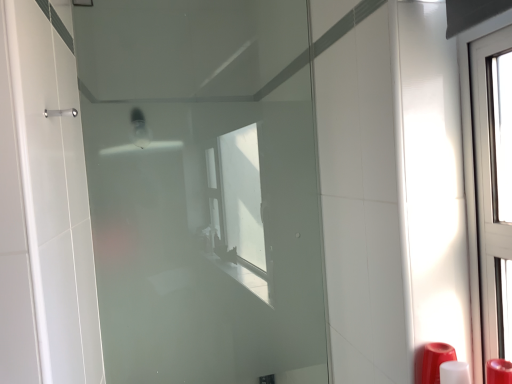
Question: Considering the positions of point (218, 317) and point (503, 367), is point (218, 317) closer or farther from the camera than point (503, 367)?

Choices:
 (A) closer
 (B) farther

Answer: (B)

Question: Is frosted glass door at center inside the boundaries of red plastic soap dispenser at lower right, or outside?

Choices:
 (A) outside
 (B) inside

Answer: (A)

Question: From a real-world perspective, is frosted glass door at center physically located above or below red plastic soap dispenser at lower right?

Choices:
 (A) above
 (B) below

Answer: (A)

Question: From their relative heights in the image, would you say red plastic soap dispenser at lower right is taller or shorter than frosted glass door at center?

Choices:
 (A) tall
 (B) short

Answer: (B)

Question: From the image's perspective, relative to frosted glass door at center, is red plastic soap dispenser at lower right above or below?

Choices:
 (A) below
 (B) above

Answer: (A)

Question: In terms of width, does red plastic soap dispenser at lower right look wider or thinner when compared to frosted glass door at center?

Choices:
 (A) thin
 (B) wide

Answer: (B)

Question: Is red plastic soap dispenser at lower right in front of or behind frosted glass door at center in the image?

Choices:
 (A) behind
 (B) front

Answer: (B)